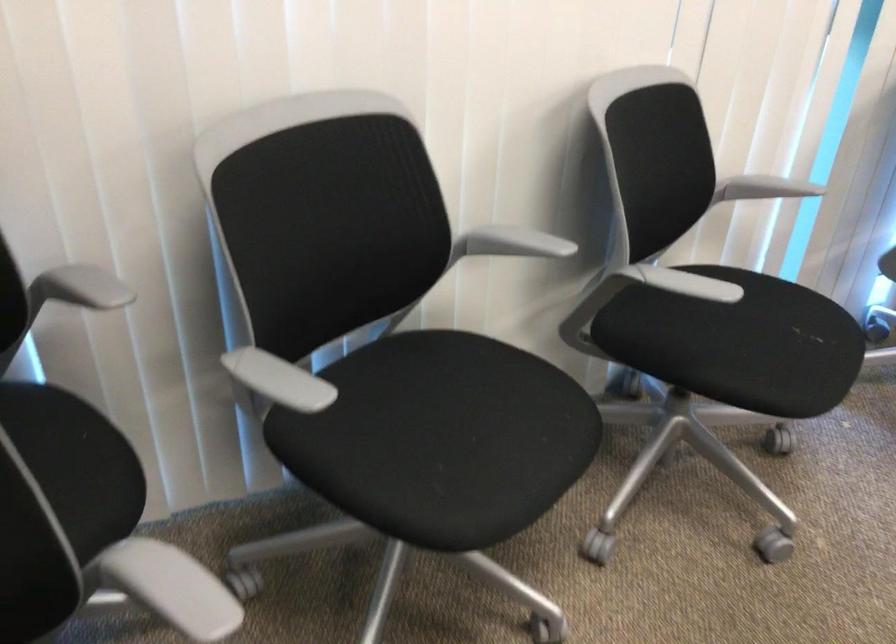
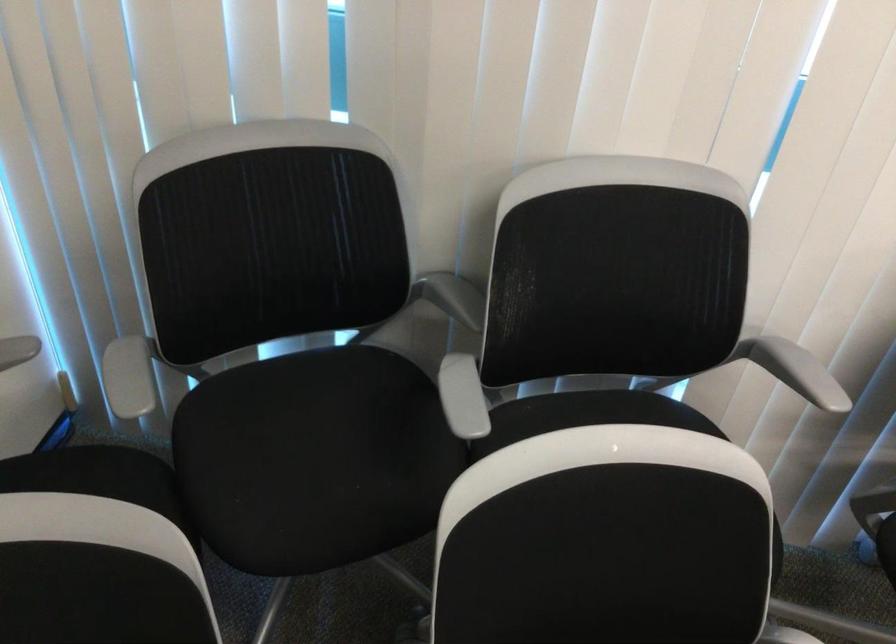
Find the pixel in the second image that matches point 82,279 in the first image.

(794, 370)